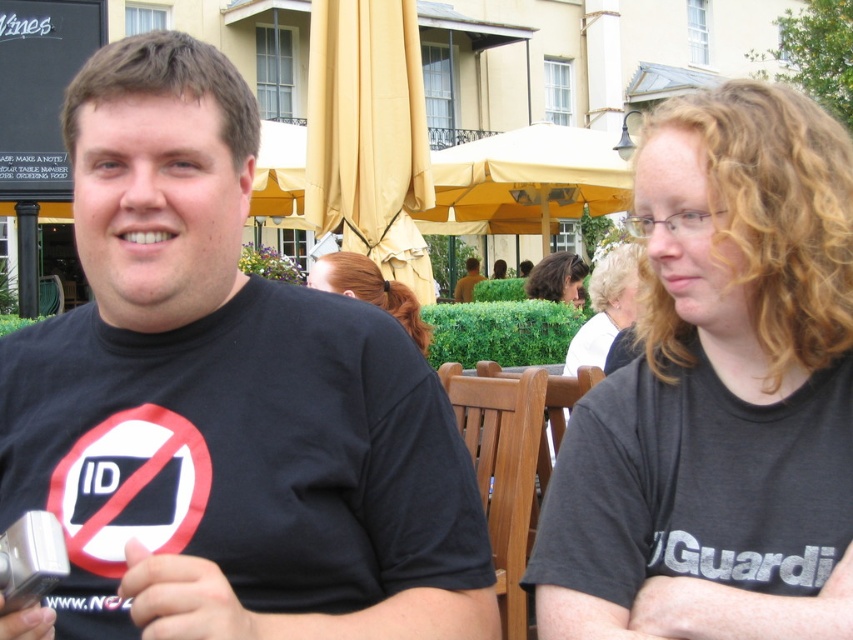
Is point (608, 268) farther from viewer compared to point (412, 294)?

Yes, point (608, 268) is farther from viewer.

Is the position of white fabric shirt at upper center more distant than that of blonde hair at center?

Yes, it is behind blonde hair at center.

This screenshot has width=853, height=640. Describe the element at coordinates (606, 307) in the screenshot. I see `white fabric shirt at upper center` at that location.

Image resolution: width=853 pixels, height=640 pixels. What are the coordinates of `white fabric shirt at upper center` in the screenshot? It's located at (606, 307).

Which is behind, point (612, 312) or point (540, 262)?

The point (540, 262) is more distant.

Measure the distance between point (628, 300) and camera.

Point (628, 300) and camera are 43.80 feet apart from each other.

Where is `white fabric shirt at upper center`? The height and width of the screenshot is (640, 853). white fabric shirt at upper center is located at coordinates (606, 307).

Is blonde hair at center bigger than curly hair at center?

Yes.

In the scene shown: Can you confirm if blonde hair at center is positioned above curly hair at center?

Actually, blonde hair at center is below curly hair at center.

Describe the element at coordinates (369, 289) in the screenshot. I see `blonde hair at center` at that location.

Locate an element on the screen. This screenshot has width=853, height=640. blonde hair at center is located at coordinates (369, 289).